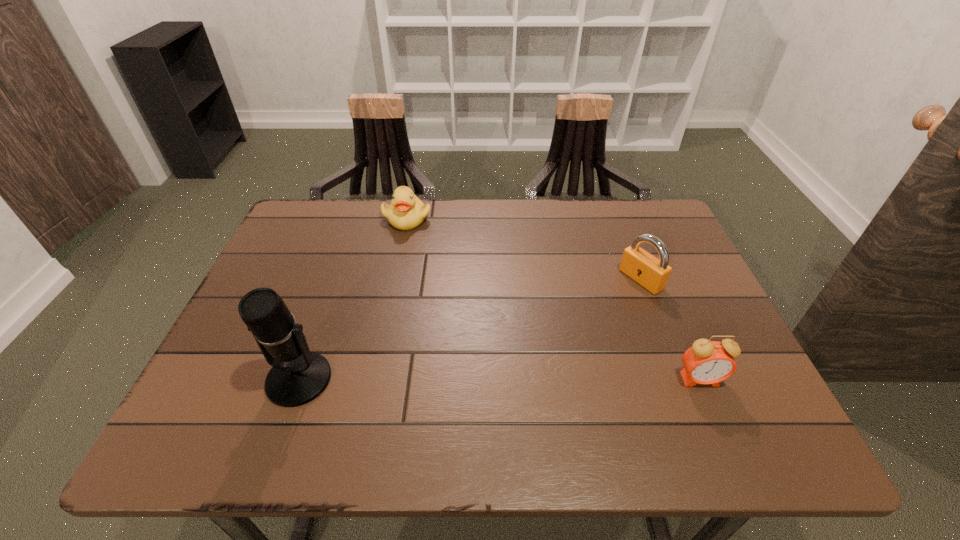
Identify the location of vacant position located 0.290m on the front-facing side of the shortest object. (458, 293).

Locate an element on the screen. The width and height of the screenshot is (960, 540). vacant space located 0.380m on the front-facing side of the shortest object is located at coordinates (474, 316).

Locate an element on the screen. vacant point located 0.070m on the front-facing side of the shortest object is located at coordinates (425, 244).

Find the location of a particular element. object that is at the far edge is located at coordinates (406, 211).

Locate an element on the screen. microphone at the near edge is located at coordinates (298, 376).

This screenshot has width=960, height=540. In order to click on alarm clock that is at the near edge in this screenshot , I will do `click(707, 362)`.

Where is `object that is at the left edge`? The image size is (960, 540). object that is at the left edge is located at coordinates (298, 376).

In order to click on alarm clock at the right edge in this screenshot , I will do `click(707, 362)`.

Where is `padlock that is at the right edge`? This screenshot has width=960, height=540. padlock that is at the right edge is located at coordinates (641, 266).

You are a GUI agent. You are given a task and a screenshot of the screen. Output one action in this format:
    pyautogui.click(x=<x>, y=<y>)
    Task: Click on the object that is at the near left corner
    
    Given the screenshot: What is the action you would take?
    pyautogui.click(x=298, y=376)